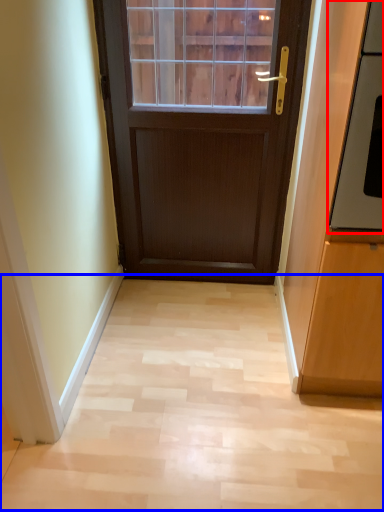
Question: Which point is closer to the camera, oven (highlighted by a red box) or corridor (highlighted by a blue box)?

Choices:
 (A) oven
 (B) corridor

Answer: (A)